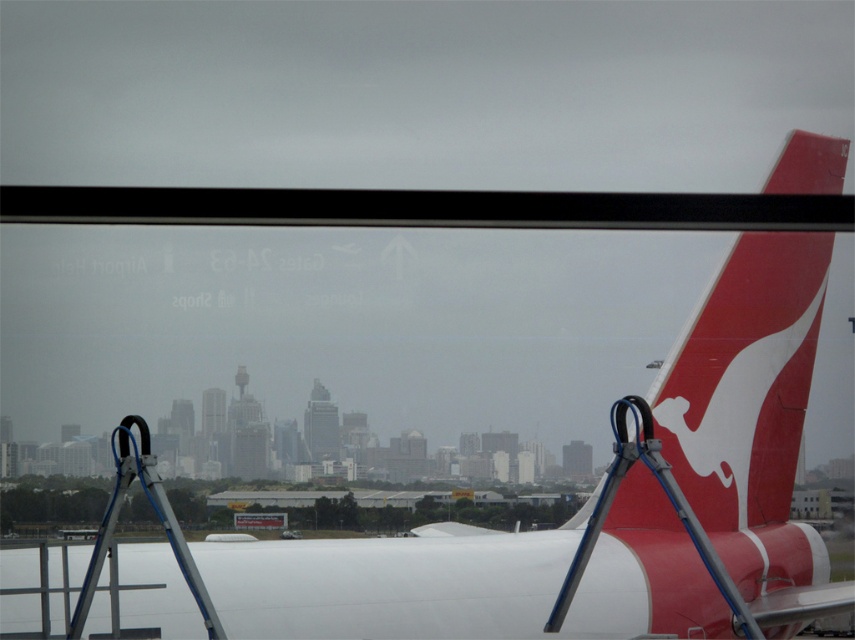
Question: Which point appears closest to the camera in this image?

Choices:
 (A) (174, 529)
 (B) (687, 378)

Answer: (A)

Question: Is red matte airplane tail at right thinner than silver metallic ladder at center?

Choices:
 (A) yes
 (B) no

Answer: (B)

Question: Is red matte airplane tail at right positioned before silver metallic ladder at center?

Choices:
 (A) no
 (B) yes

Answer: (A)

Question: Is red matte airplane tail at right thinner than silver metallic ladder at center?

Choices:
 (A) yes
 (B) no

Answer: (B)